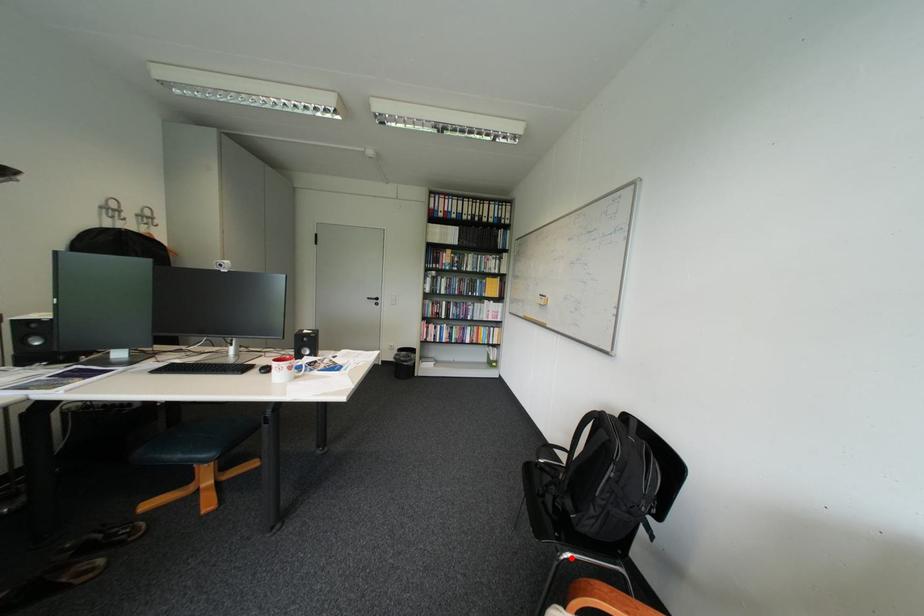
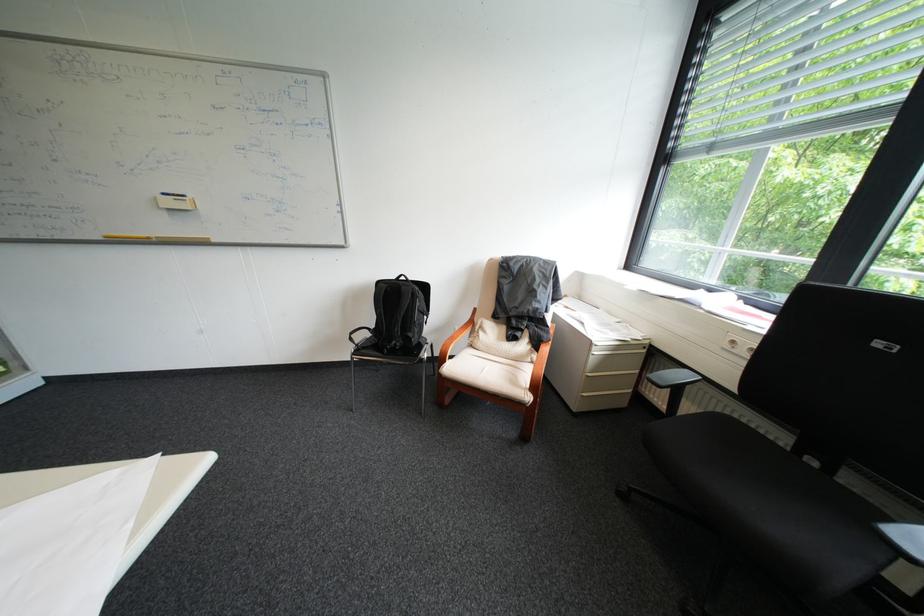
Question: I am providing you with two images of the same scene from different viewpoints. In image1, a red point is highlighted. Considering the same 3D point in image2, which of the following is correct?

Choices:
 (A) It is closer
 (B) It is farther

Answer: (B)